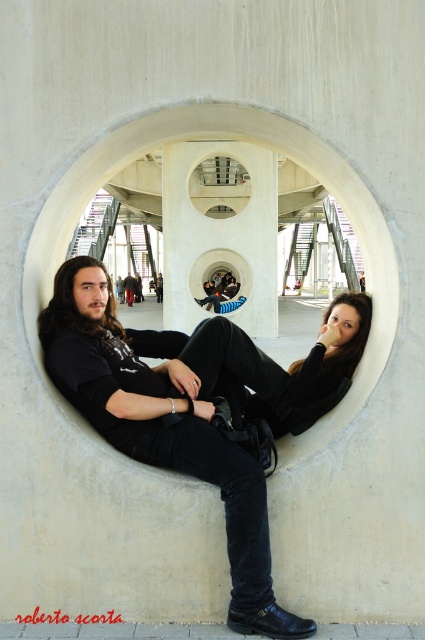
Is smooth black hair at center smaller than concrete/smooth hole at center?

Yes.

Describe the element at coordinates (172, 422) in the screenshot. I see `smooth black hair at center` at that location.

Is point (303, 621) closer to viewer compared to point (246, 106)?

Yes, point (303, 621) is closer to viewer.

At what (x,y) coordinates should I click in order to perform the action: click on smooth black hair at center. Please return your answer as a coordinate pair (x, y). Looking at the image, I should click on (172, 422).

Is smooth black hair at center closer to the viewer compared to black denim jeans at lower center?

That is True.

Can you confirm if smooth black hair at center is shorter than black denim jeans at lower center?

No, smooth black hair at center is not shorter than black denim jeans at lower center.

Find the location of `smooth black hair at center`. smooth black hair at center is located at coordinates pos(172,422).

This screenshot has height=640, width=425. I want to click on smooth black hair at center, so click(x=172, y=422).

Between concrete/smooth hole at center and transparent glass hole at center, which one appears on the left side from the viewer's perspective?

transparent glass hole at center is more to the left.

Is concrete/smooth hole at center positioned behind transparent glass hole at center?

No, it is in front of transparent glass hole at center.

The width and height of the screenshot is (425, 640). Find the location of `concrete/smooth hole at center`. concrete/smooth hole at center is located at coordinates (229, 156).

Locate an element on the screen. The width and height of the screenshot is (425, 640). concrete/smooth hole at center is located at coordinates (229, 156).